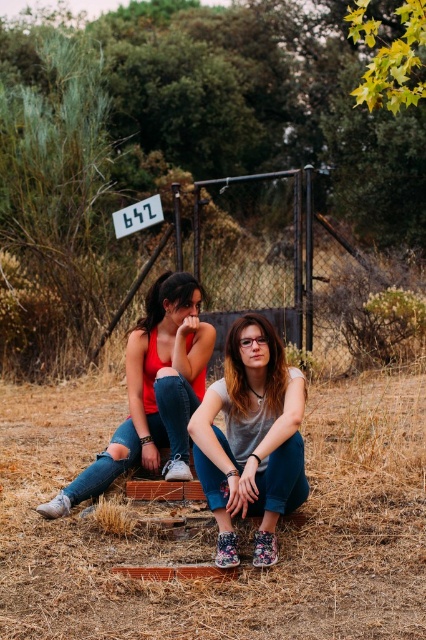
You are a photographer trying to capture a closeup of the brown dry grass at lower center and the matte red tank top at left. Which object should you zoom in on first if you want to focus on the wider one?

The brown dry grass at lower center is wider than the matte red tank top at left, so you should zoom in on the brown dry grass at lower center first.

You are trying to locate the matte gray shirt at center and the matte red tank top at left in the image. Based on their positions, which one is closer to the chain link fence in the background?

The matte red tank top at left is closer to the chain link fence in the background because the matte gray shirt at center is positioned to its right, meaning it is further away from the fence.

You are standing in the image and want to place a small flag at the point marked as point (x=213, y=529). Based on the scene description, what type of terrain will the flag be placed on?

A: The point (x=213, y=529) corresponds to brown dry grass at lower center, so the flag will be placed on dry grass terrain.